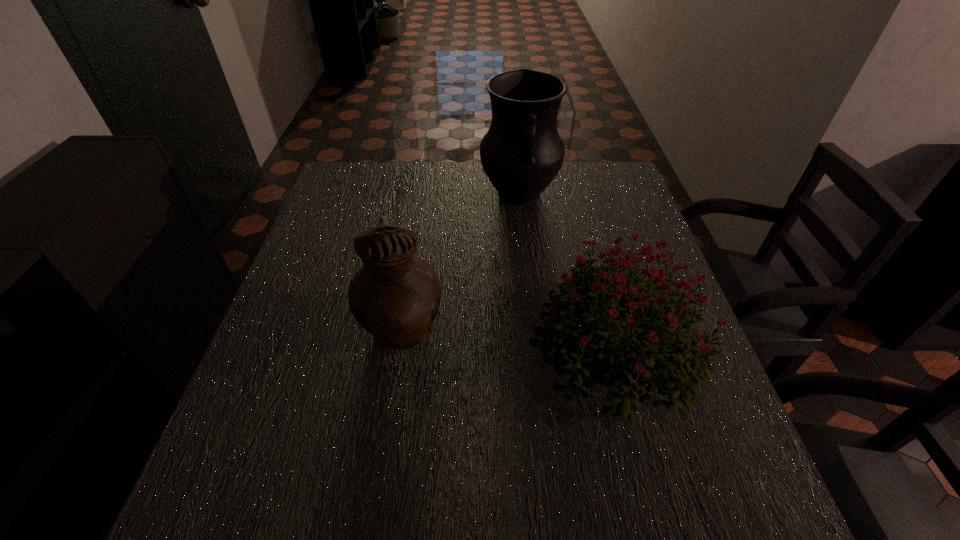
Locate an element on the screen. Image resolution: width=960 pixels, height=540 pixels. vacant region at the far edge is located at coordinates (417, 187).

Where is `vacant region at the near edge of the desktop`? vacant region at the near edge of the desktop is located at coordinates (513, 490).

Where is `vacant area at the left edge of the desktop`? vacant area at the left edge of the desktop is located at coordinates pos(296,289).

In the image, there is a desktop. Identify the location of vacant area at the right edge. The width and height of the screenshot is (960, 540). (703, 464).

At what (x,y) coordinates should I click in order to perform the action: click on blank space at the far right corner. Please return your answer as a coordinate pair (x, y). Looking at the image, I should click on (615, 205).

Where is `blank region between the farthest object and the left pitcher`? The width and height of the screenshot is (960, 540). blank region between the farthest object and the left pitcher is located at coordinates (460, 265).

In order to click on vacant point located between the right pitcher and the leftmost object in this screenshot , I will do `click(460, 265)`.

Where is `free space between the right pitcher and the left pitcher`? Image resolution: width=960 pixels, height=540 pixels. free space between the right pitcher and the left pitcher is located at coordinates (460, 265).

At what (x,y) coordinates should I click in order to perform the action: click on free spot between the leftmost object and the bouquet. Please return your answer as a coordinate pair (x, y). This screenshot has height=540, width=960. Looking at the image, I should click on coord(506,343).

The image size is (960, 540). What are the coordinates of `vacant point located between the nearer pitcher and the bouquet` in the screenshot? It's located at (506, 343).